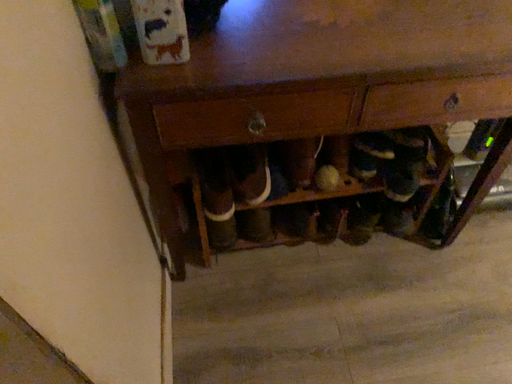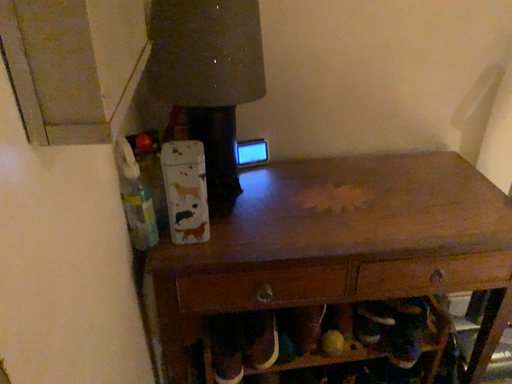
Question: How did the camera likely rotate when shooting the video?

Choices:
 (A) rotated upward
 (B) rotated downward

Answer: (A)